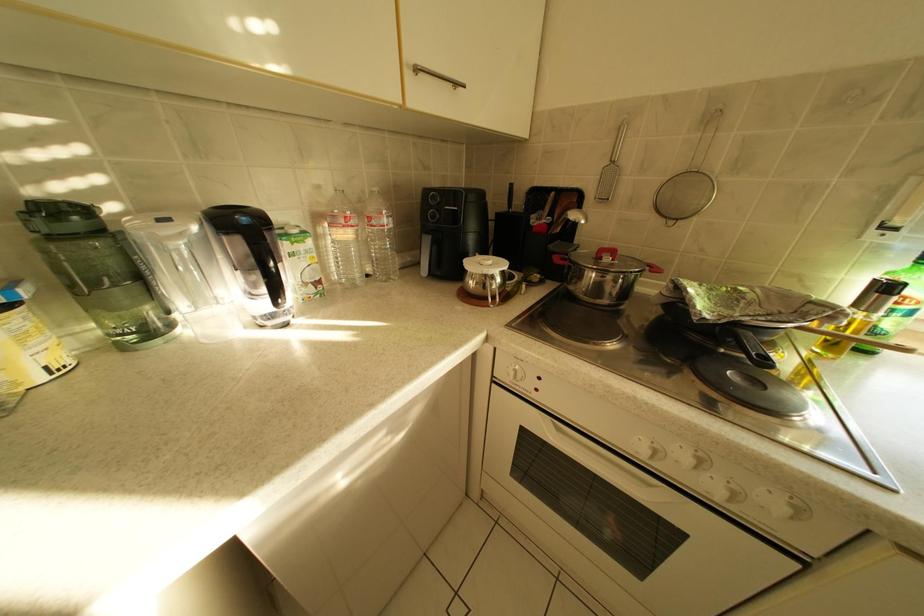
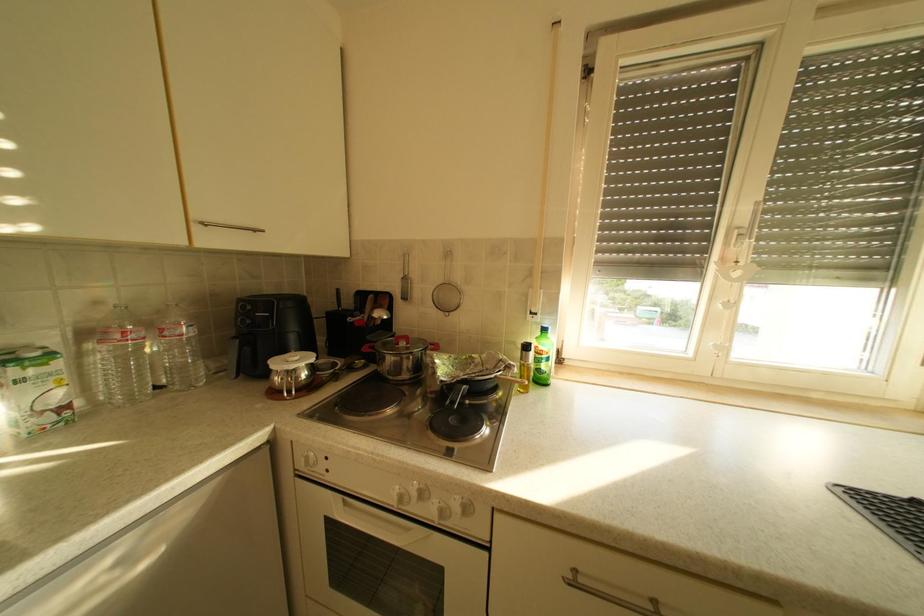
In the scene shown: Which direction would the cameraman need to move to produce the second image?

The cameraman moved toward right, backward.